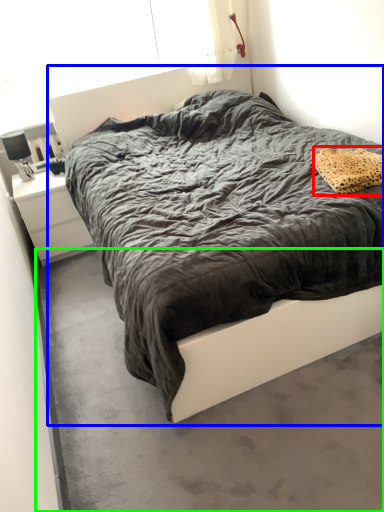
Question: Estimate the real-world distances between objects in this image. Which object is closer to pillow (highlighted by a red box), bed (highlighted by a blue box) or concrete (highlighted by a green box)?

Choices:
 (A) bed
 (B) concrete

Answer: (A)